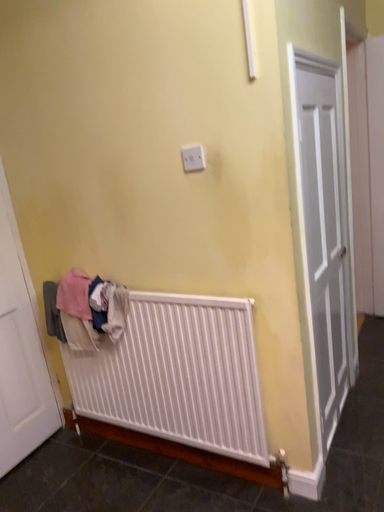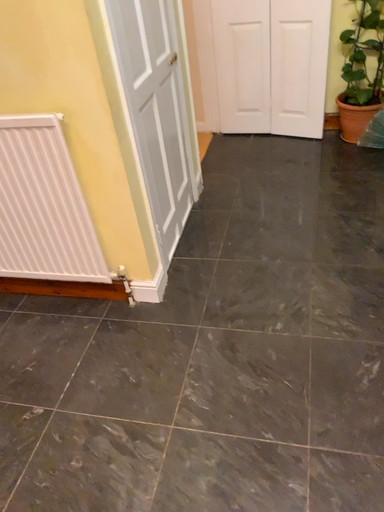
Question: Which way did the camera rotate in the video?

Choices:
 (A) rotated upward
 (B) rotated downward

Answer: (B)